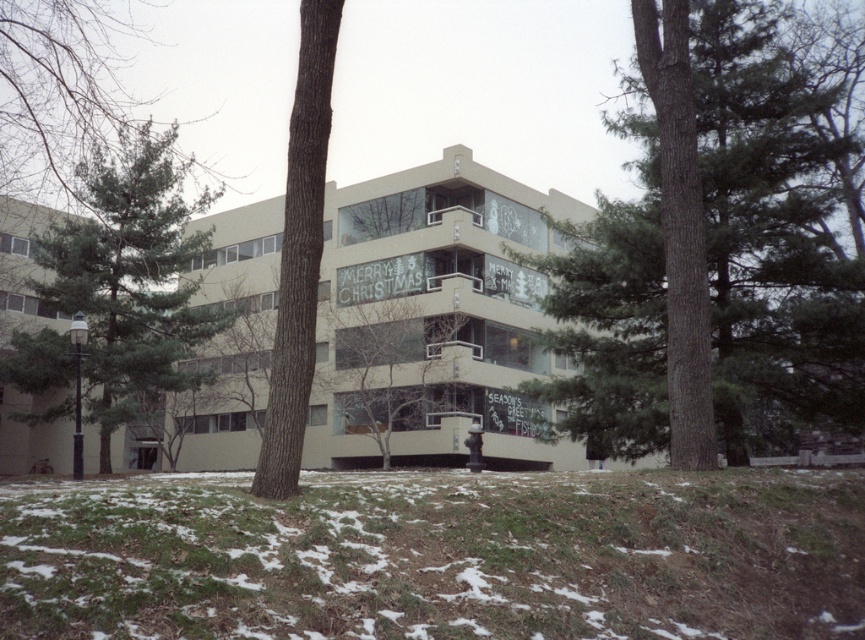
Question: Which object is closer to the camera taking this photo?

Choices:
 (A) green needle-like tree at left
 (B) brown rough bark tree at center

Answer: (B)

Question: Which object is positioned closest to the green needle-like tree at left?

Choices:
 (A) green textured tree at center
 (B) green leafy tree at center

Answer: (B)

Question: Does brown rough bark tree at center have a larger size compared to green leafy tree at center?

Choices:
 (A) yes
 (B) no

Answer: (A)

Question: Is green textured tree at center wider than green leafy tree at center?

Choices:
 (A) yes
 (B) no

Answer: (A)

Question: Among these objects, which one is nearest to the camera?

Choices:
 (A) green needle-like tree at left
 (B) brown rough bark tree at center
 (C) green leafy tree at upper left
 (D) green textured tree at center

Answer: (B)

Question: Does green needle-like tree at left have a lesser width compared to brown rough bark tree at center?

Choices:
 (A) yes
 (B) no

Answer: (B)